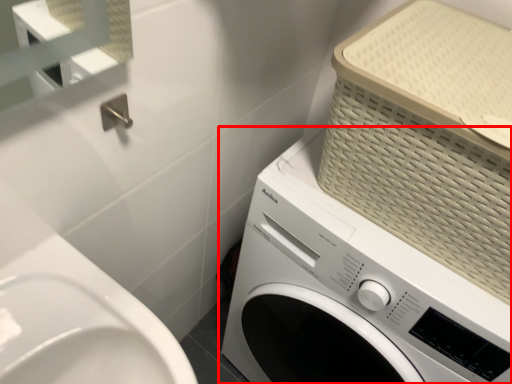
Question: From the image's perspective, what is the correct spatial positioning of washing machine (annotated by the red box) in reference to basket?

Choices:
 (A) above
 (B) below

Answer: (B)